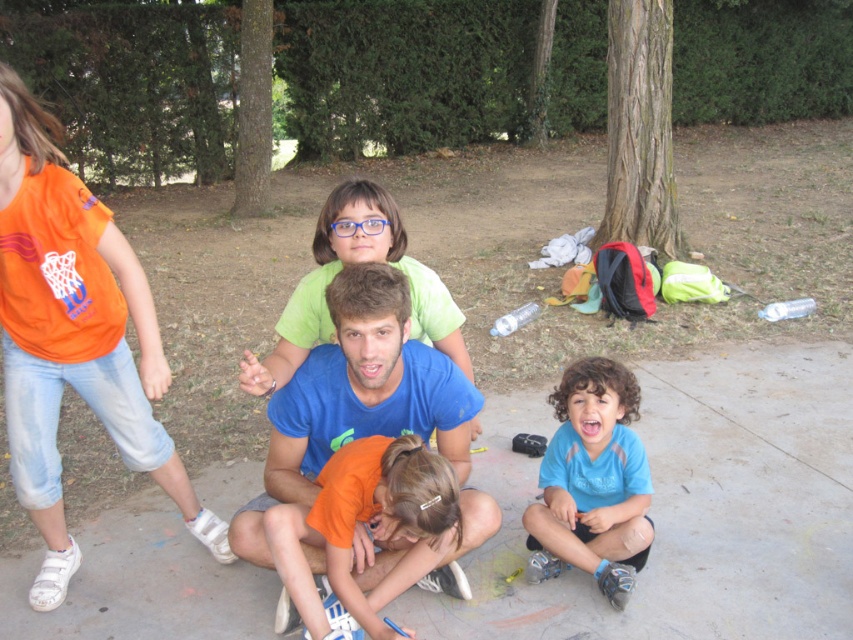
You are a photographer trying to capture a group photo of the orange cotton shirt at left and the orange cotton shirt at lower center. Which orange cotton shirt should you focus on first if you want to include both in the frame without moving the camera?

The orange cotton shirt at left is positioned on the left side of orange cotton shirt at lower center, so you should focus on the orange cotton shirt at left first to ensure both are in the frame without moving the camera.

You are standing at the center of the park and want to locate the orange cotton shirt at left. Which direction should you turn to face it?

The orange cotton shirt at left is located at point (73, 337), so you should turn to your left to face it.

Looking at this image, you are a photographer standing at the edge of the park. You want to take a photo of the blue cotton shirt at center and orange cotton shirt at lower center so that they appear close together in the picture. Given that your camera has a maximum focus range of 5 inches, will you be able to capture both subjects within the same frame without moving closer?

The distance between the blue cotton shirt at center and orange cotton shirt at lower center is 5.10 inches. Since the camera can only focus within 5 inches, the subjects are slightly out of the focus range. Therefore, you might need to move closer to ensure both are in focus.